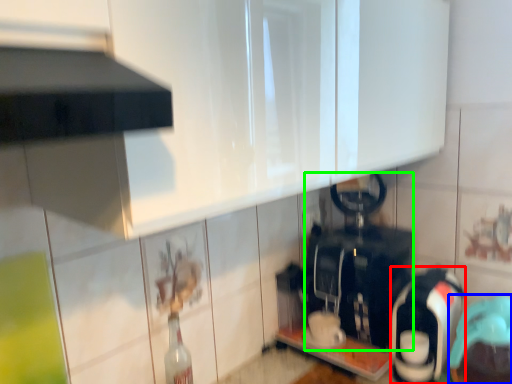
Question: Based on their relative distances, which object is farther from appliance (highlighted by a red box)? Choose from appliance (highlighted by a blue box) and appliance (highlighted by a green box).

Choices:
 (A) appliance
 (B) appliance

Answer: (B)